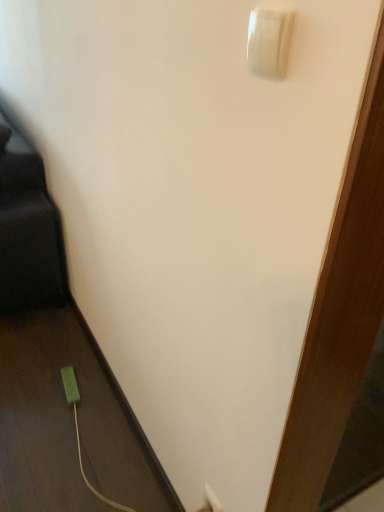
Question: Choose the correct answer: Is green plastic power plug at lower left inside white glossy light switch at upper right or outside it?

Choices:
 (A) inside
 (B) outside

Answer: (B)

Question: Is green plastic power plug at lower left wider or thinner than white glossy light switch at upper right?

Choices:
 (A) thin
 (B) wide

Answer: (B)

Question: Is green plastic power plug at lower left bigger or smaller than white glossy light switch at upper right?

Choices:
 (A) small
 (B) big

Answer: (B)

Question: From the image's perspective, is white glossy light switch at upper right positioned above or below green plastic power plug at lower left?

Choices:
 (A) above
 (B) below

Answer: (A)

Question: Looking at their shapes, would you say white glossy light switch at upper right is wider or thinner than green plastic power plug at lower left?

Choices:
 (A) thin
 (B) wide

Answer: (A)

Question: Is point (248, 38) closer or farther from the camera than point (77, 397)?

Choices:
 (A) farther
 (B) closer

Answer: (B)

Question: In the image, is white glossy light switch at upper right positioned in front of or behind green plastic power plug at lower left?

Choices:
 (A) front
 (B) behind

Answer: (A)